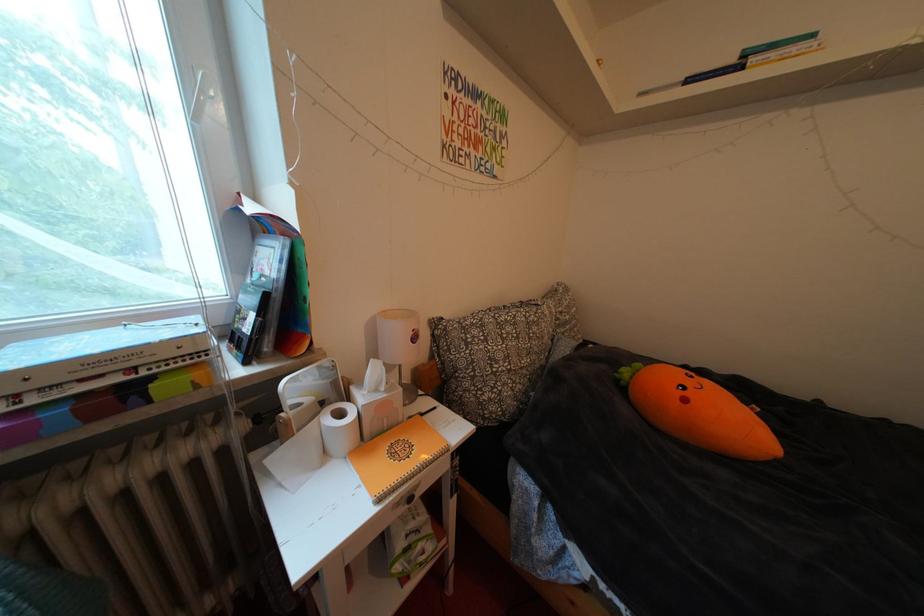
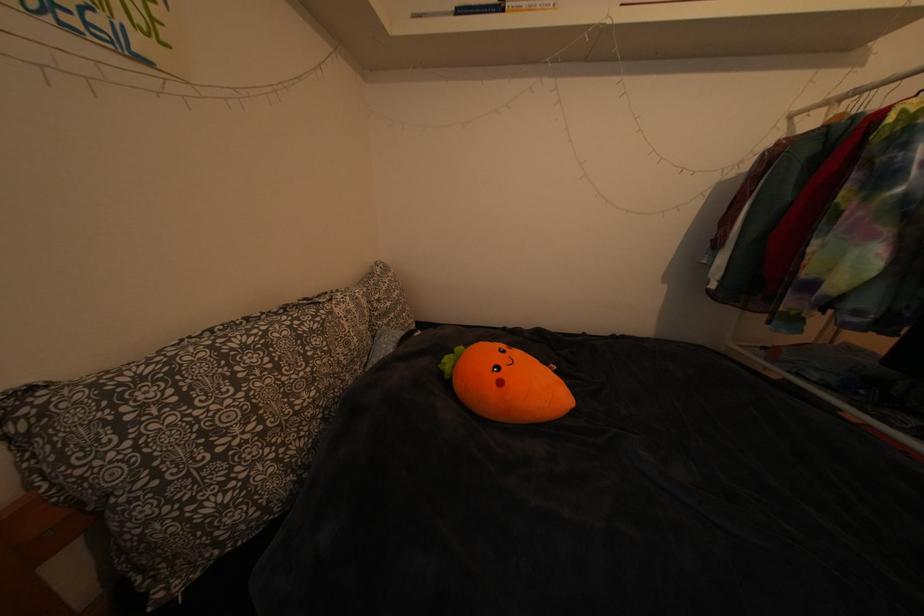
Where in the second image is the point corresponding to (x=554, y=321) from the first image?

(359, 317)